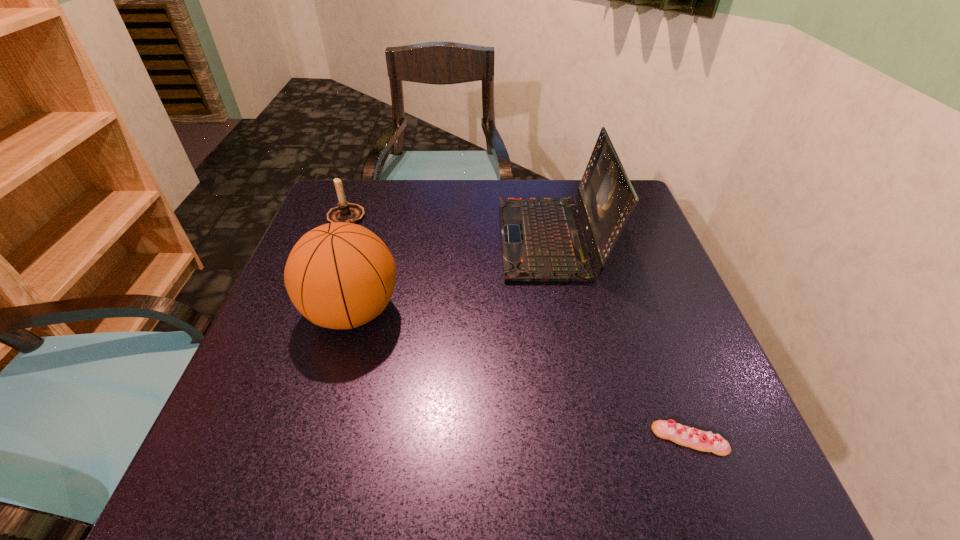
You are a GUI agent. You are given a task and a screenshot of the screen. Output one action in this format:
    pyautogui.click(x=<x>, y=<y>)
    Task: Click on the vacant point located between the shortest object and the laptop computer
    Image resolution: width=960 pixels, height=540 pixels.
    Given the screenshot: What is the action you would take?
    pyautogui.click(x=620, y=339)

Where is `free point between the candle holder and the nearest object`? This screenshot has height=540, width=960. free point between the candle holder and the nearest object is located at coordinates (517, 328).

At what (x,y) coordinates should I click in order to perform the action: click on empty space that is in between the basketball and the nearest object. Please return your answer as a coordinate pair (x, y). The width and height of the screenshot is (960, 540). Looking at the image, I should click on (520, 376).

Where is `vacant space in between the shortest object and the laptop computer`? The width and height of the screenshot is (960, 540). vacant space in between the shortest object and the laptop computer is located at coordinates (620, 339).

The image size is (960, 540). What are the coordinates of `free space between the laptop computer and the second shortest object` in the screenshot? It's located at (448, 228).

Find the location of `blank region between the eclair and the laptop computer`. blank region between the eclair and the laptop computer is located at coordinates (620, 339).

The image size is (960, 540). Find the location of `empty space that is in between the nearest object and the laptop computer`. empty space that is in between the nearest object and the laptop computer is located at coordinates (620, 339).

Where is `vacant region between the laptop computer and the shortest object`? This screenshot has width=960, height=540. vacant region between the laptop computer and the shortest object is located at coordinates (620, 339).

The height and width of the screenshot is (540, 960). In order to click on the second closest object to the eclair in this screenshot , I will do `click(341, 275)`.

The height and width of the screenshot is (540, 960). I want to click on object that is the third closest to the third tallest object, so click(680, 434).